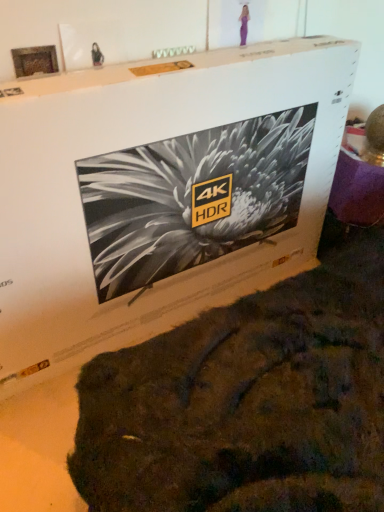
This screenshot has height=512, width=384. What do you see at coordinates (159, 193) in the screenshot?
I see `white cardboard box at upper center` at bounding box center [159, 193].

In order to face white cardboard box at upper center, should I rotate leftwards or rightwards?

To face it directly, rotate left by 2.823 degrees.

This screenshot has width=384, height=512. Find the location of `white cardboard box at upper center`. white cardboard box at upper center is located at coordinates (159, 193).

I want to click on white cardboard box at upper center, so click(159, 193).